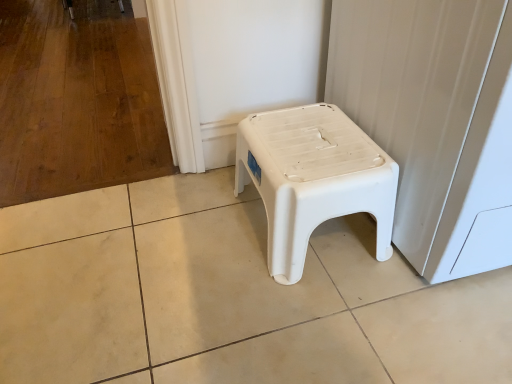
Question: Is white plastic stool at center not close to white plastic stool at lower right?

Choices:
 (A) yes
 (B) no

Answer: (B)

Question: Is white plastic stool at center turned away from white plastic stool at lower right?

Choices:
 (A) yes
 (B) no

Answer: (B)

Question: Would you say white plastic stool at center is outside white plastic stool at lower right?

Choices:
 (A) no
 (B) yes

Answer: (B)

Question: Does white plastic stool at center have a greater width compared to white plastic stool at lower right?

Choices:
 (A) yes
 (B) no

Answer: (B)

Question: From a real-world perspective, is white plastic stool at center below white plastic stool at lower right?

Choices:
 (A) no
 (B) yes

Answer: (B)

Question: From a real-world perspective, is white plastic stool at center physically above white plastic stool at lower right?

Choices:
 (A) yes
 (B) no

Answer: (B)

Question: From the image's perspective, is white plastic stool at lower right over white plastic stool at center?

Choices:
 (A) no
 (B) yes

Answer: (B)

Question: Does white plastic stool at lower right have a greater width compared to white plastic stool at center?

Choices:
 (A) no
 (B) yes

Answer: (B)

Question: Is white plastic stool at lower right not inside white plastic stool at center?

Choices:
 (A) yes
 (B) no

Answer: (A)

Question: Is white plastic stool at lower right next to white plastic stool at center?

Choices:
 (A) no
 (B) yes

Answer: (A)

Question: Can you confirm if white plastic stool at lower right is thinner than white plastic stool at center?

Choices:
 (A) no
 (B) yes

Answer: (A)

Question: Is white plastic stool at lower right further to the viewer compared to white plastic stool at center?

Choices:
 (A) no
 (B) yes

Answer: (A)

Question: Looking at their shapes, would you say white plastic stool at center is wider or thinner than white plastic stool at lower right?

Choices:
 (A) thin
 (B) wide

Answer: (A)